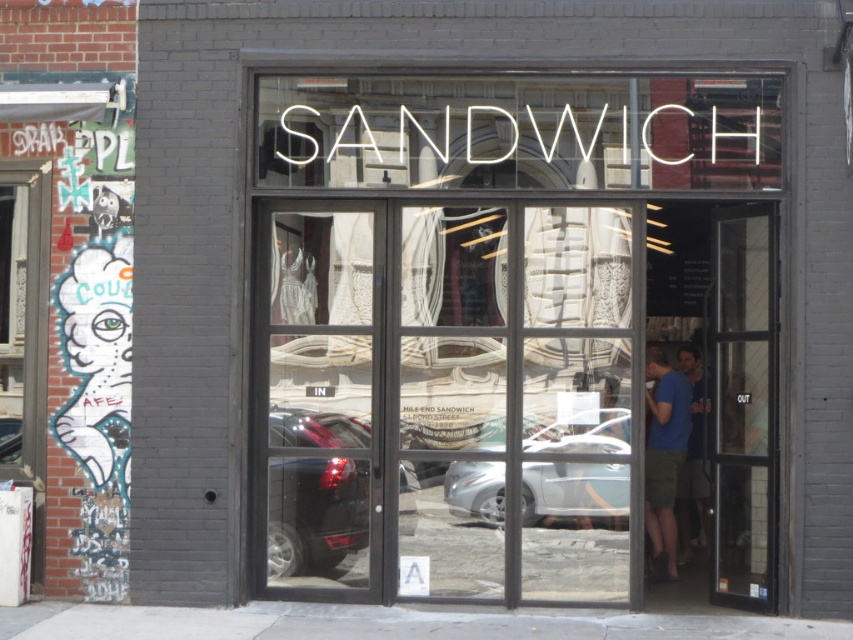
Question: Does white glass at center have a smaller size compared to blue cotton shirt at center?

Choices:
 (A) yes
 (B) no

Answer: (B)

Question: Which object appears farthest from the camera in this image?

Choices:
 (A) black matte car at center
 (B) blue cotton shirt at right

Answer: (B)

Question: Does transparent glass door at right appear on the left side of blue cotton shirt at right?

Choices:
 (A) no
 (B) yes

Answer: (A)

Question: Which of the following is the farthest from the observer?

Choices:
 (A) silver metallic car at center
 (B) transparent glass door at right

Answer: (A)

Question: Can you confirm if white glass at center is smaller than blue cotton shirt at center?

Choices:
 (A) yes
 (B) no

Answer: (B)

Question: Among these objects, which one is nearest to the camera?

Choices:
 (A) black matte car at center
 (B) white graffiti art at left
 (C) white glass at center
 (D) blue cotton shirt at center

Answer: (C)